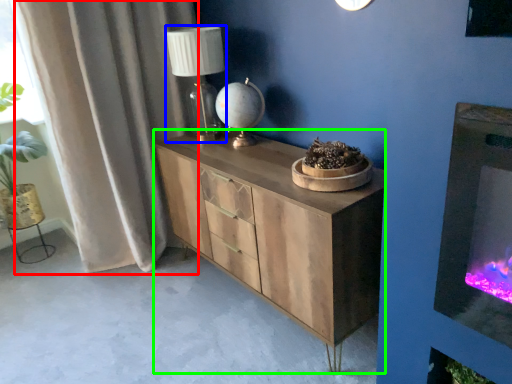
Question: Which is farther away from curtain (highlighted by a red box)? table lamp (highlighted by a blue box) or chest of drawers (highlighted by a green box)?

Choices:
 (A) table lamp
 (B) chest of drawers

Answer: (B)